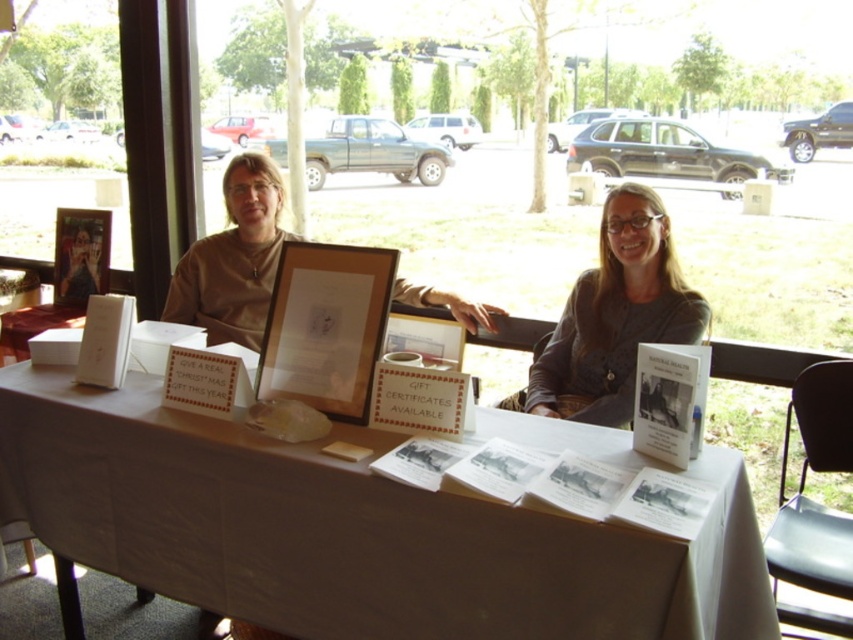
Which is more to the left, gray denim jacket at center or matte glass picture frame at center?

From the viewer's perspective, matte glass picture frame at center appears more on the left side.

Which is behind, point (640, 339) or point (79, 259)?

The point (79, 259) is more distant.

Does point (634, 308) come in front of point (85, 253)?

Yes.

Locate an element on the screen. This screenshot has height=640, width=853. gray denim jacket at center is located at coordinates tap(614, 316).

Is gray denim jacket at center to the right of matte brown shirt at center from the viewer's perspective?

Indeed, gray denim jacket at center is positioned on the right side of matte brown shirt at center.

Does gray denim jacket at center have a greater height compared to matte brown shirt at center?

Incorrect, gray denim jacket at center's height is not larger of matte brown shirt at center's.

Consider the image. Who is more distant from viewer, (573, 413) or (213, 304)?

The point (213, 304) is behind.

The height and width of the screenshot is (640, 853). What are the coordinates of `gray denim jacket at center` in the screenshot? It's located at (614, 316).

Between gray denim jacket at center and wooden frame at center, which one has less height?

Standing shorter between the two is wooden frame at center.

What do you see at coordinates (614, 316) in the screenshot?
I see `gray denim jacket at center` at bounding box center [614, 316].

You are a GUI agent. You are given a task and a screenshot of the screen. Output one action in this format:
    pyautogui.click(x=<x>, y=<y>)
    Task: Click on the gray denim jacket at center
    
    Given the screenshot: What is the action you would take?
    pyautogui.click(x=614, y=316)